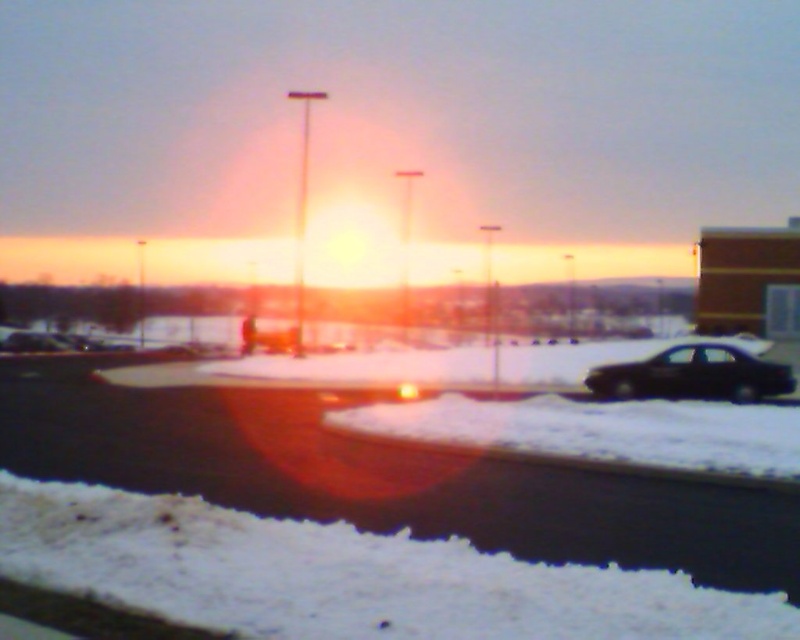
Does white fluffy snow at lower left come in front of black matte car at right?

Yes, it is.

Is point (605, 637) more distant than point (678, 387)?

No, (605, 637) is in front of (678, 387).

Between point (276, 572) and point (672, 364), which one is positioned in front?

Positioned in front is point (276, 572).

You are a GUI agent. You are given a task and a screenshot of the screen. Output one action in this format:
    pyautogui.click(x=<x>, y=<y>)
    Task: Click on the white fluffy snow at lower left
    
    Given the screenshot: What is the action you would take?
    click(x=348, y=576)